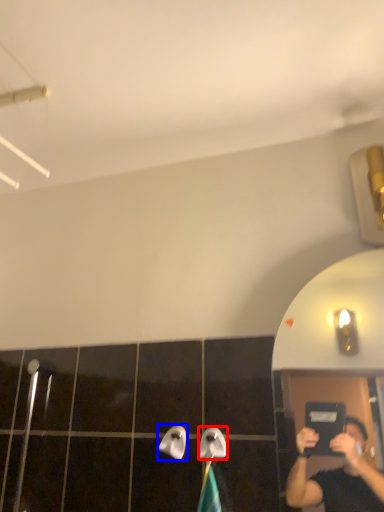
Question: Among these objects, which one is farthest to the camera, towel bar (highlighted by a red box) or towel bar (highlighted by a blue box)?

Choices:
 (A) towel bar
 (B) towel bar

Answer: (B)